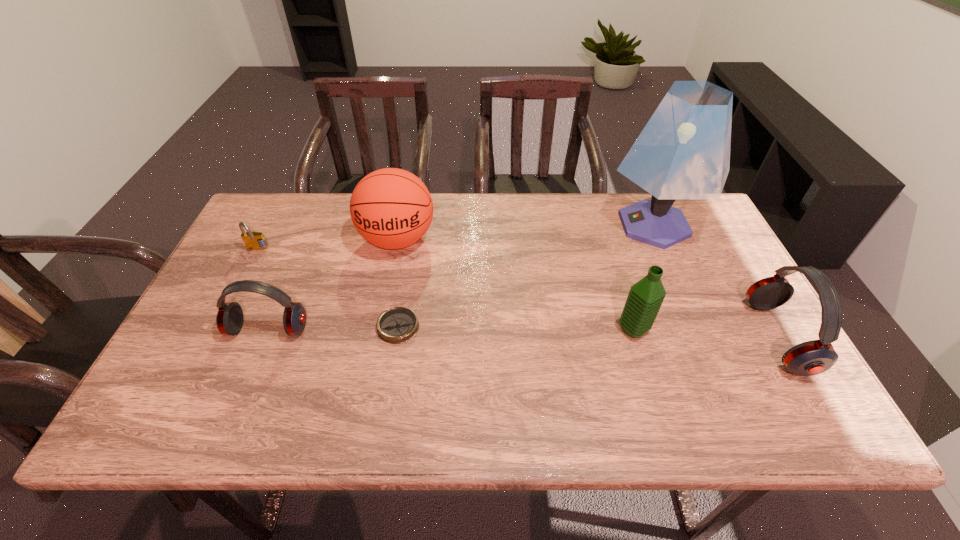
Identify the location of object that ranks as the fifth closest to the fifth tallest object. tap(683, 152).

Where is `free location that satisfies the following two spatial constraints: 1. on the ear cups of the water bottle; 2. on the right side of the left earphone`? The width and height of the screenshot is (960, 540). free location that satisfies the following two spatial constraints: 1. on the ear cups of the water bottle; 2. on the right side of the left earphone is located at coordinates (268, 330).

Identify the location of vacant point that satisfies the following two spatial constraints: 1. on the side with the combination dials of the shortest object; 2. on the left side of the second shortest object. (218, 327).

What are the coordinates of `vacant space that satisfies the following two spatial constraints: 1. on the side with the combination dials of the padlock; 2. on the right side of the water bottle` in the screenshot? It's located at (216, 330).

Identify the location of vacant space that satisfies the following two spatial constraints: 1. on the base of the lampshade; 2. on the side with the combination dials of the second shortest object. (664, 250).

Where is `free spot that satisfies the following two spatial constraints: 1. on the side with the combination dials of the padlock; 2. on the left side of the compass`? The image size is (960, 540). free spot that satisfies the following two spatial constraints: 1. on the side with the combination dials of the padlock; 2. on the left side of the compass is located at coordinates (218, 327).

The height and width of the screenshot is (540, 960). What are the coordinates of `vacant position in the image that satisfies the following two spatial constraints: 1. on the base of the lampshade; 2. on the ear cups of the shorter earphone` in the screenshot? It's located at (698, 329).